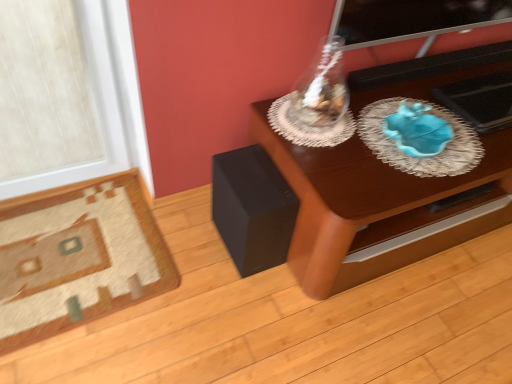
Identify the location of vacant space in front of black matte speaker at lower left. The image size is (512, 384). (232, 301).